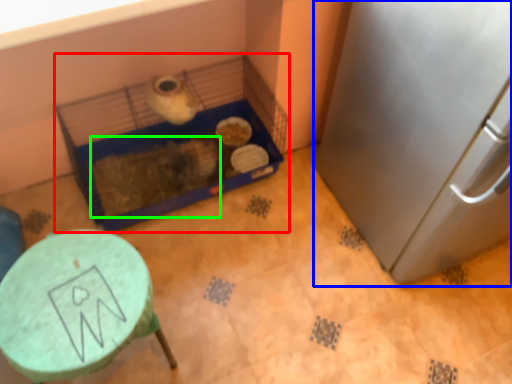
Question: Based on their relative distances, which object is nearer to bird cage (highlighted by a red box)? Choose from appliance (highlighted by a blue box) and animal (highlighted by a green box).

Choices:
 (A) appliance
 (B) animal

Answer: (B)